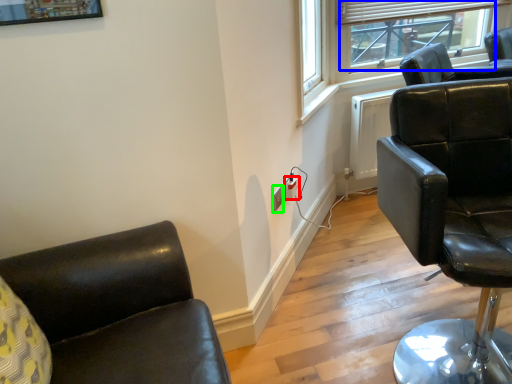
Question: Which is farther away from electric outlet (highlighted by a red box)? window screen (highlighted by a blue box) or electric outlet (highlighted by a green box)?

Choices:
 (A) window screen
 (B) electric outlet

Answer: (A)